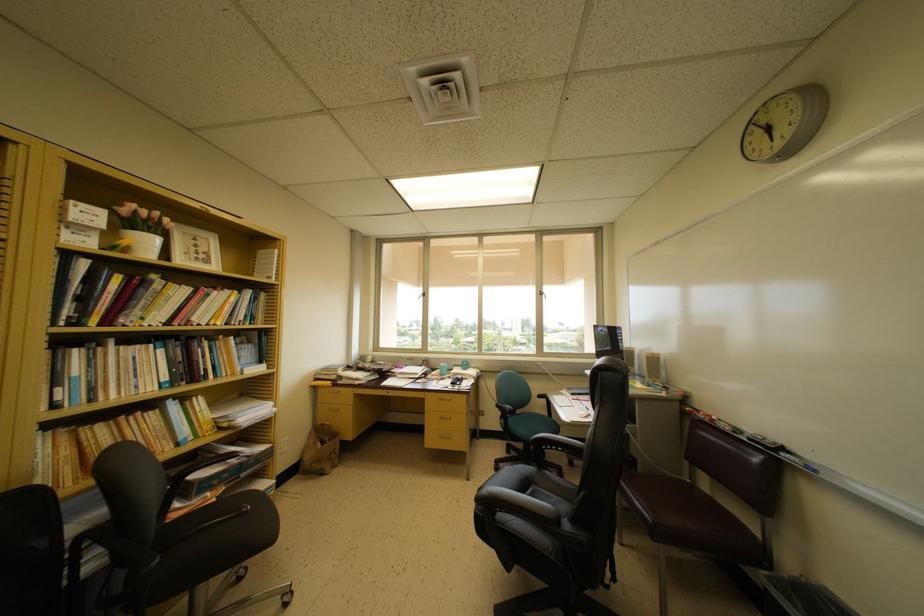
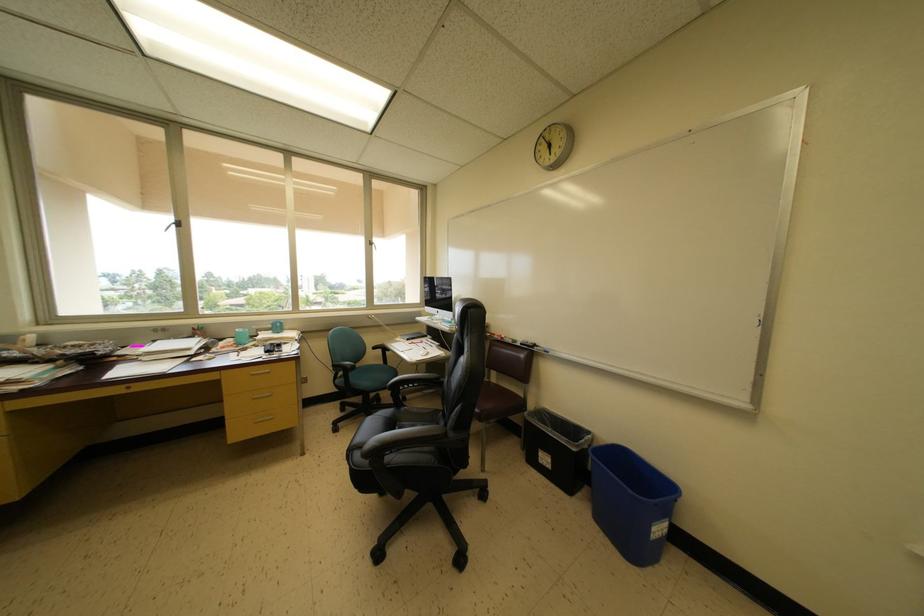
Find the pixel in the second image that matches (x=558, y=453) in the first image.

(415, 391)